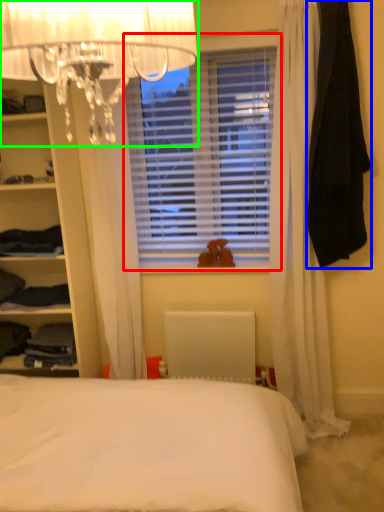
Question: Estimate the real-world distances between objects in this image. Which object is farther from window blind (highlighted by a red box), clothing (highlighted by a blue box) or lamp (highlighted by a green box)?

Choices:
 (A) clothing
 (B) lamp

Answer: (B)